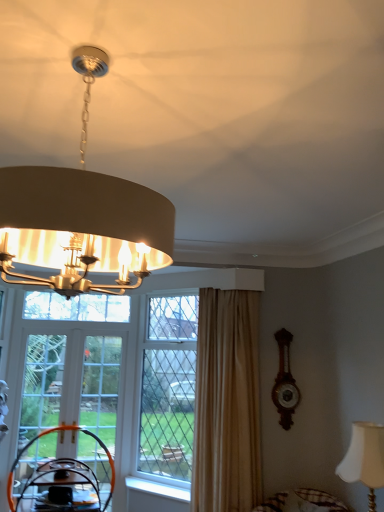
Question: Can you confirm if wooden clock at right is taller than clear glass door at lower left, the first screen door from the left?

Choices:
 (A) yes
 (B) no

Answer: (B)

Question: Considering the relative sizes of wooden clock at right and clear glass door at lower left, which is the 2th screen door from right to left, in the image provided, is wooden clock at right smaller than clear glass door at lower left, which is the 2th screen door from right to left,?

Choices:
 (A) yes
 (B) no

Answer: (A)

Question: Is wooden clock at right not near clear glass door at lower left, the first screen door from the left?

Choices:
 (A) no
 (B) yes

Answer: (B)

Question: From the image's perspective, is wooden clock at right over clear glass door at lower left, which is the 2th screen door from right to left?

Choices:
 (A) yes
 (B) no

Answer: (A)

Question: Does wooden clock at right appear on the left side of clear glass door at lower left, the first screen door from the left?

Choices:
 (A) yes
 (B) no

Answer: (B)

Question: Considering the relative sizes of wooden clock at right and clear glass door at lower left, the first screen door from the left, in the image provided, is wooden clock at right thinner than clear glass door at lower left, the first screen door from the left,?

Choices:
 (A) no
 (B) yes

Answer: (A)

Question: From a real-world perspective, is clear glass door at lower left, the first screen door from the left, positioned under matte beige lampshade at upper center, the 2th lamp when ordered from back to front, based on gravity?

Choices:
 (A) no
 (B) yes

Answer: (B)

Question: Are clear glass door at lower left, which is the 2th screen door from right to left, and matte beige lampshade at upper center, the 2th lamp from the bottom, located far from each other?

Choices:
 (A) yes
 (B) no

Answer: (A)

Question: Are clear glass door at lower left, the first screen door from the left, and matte beige lampshade at upper center, the 2th lamp when ordered from back to front, beside each other?

Choices:
 (A) yes
 (B) no

Answer: (B)

Question: Is clear glass door at lower left, which is the 2th screen door from right to left, oriented towards matte beige lampshade at upper center, the 2th lamp when ordered from back to front?

Choices:
 (A) no
 (B) yes

Answer: (B)

Question: Can you confirm if clear glass door at lower left, which is the 2th screen door from right to left, is thinner than matte beige lampshade at upper center, the first lamp viewed from the top?

Choices:
 (A) no
 (B) yes

Answer: (B)

Question: Could matte beige lampshade at upper center, the 2th lamp when ordered from right to left, be considered to be inside clear glass door at lower left, which is the 2th screen door from right to left?

Choices:
 (A) no
 (B) yes

Answer: (A)

Question: Is white fabric lampshade at lower right, which is the first lamp in right-to-left order, shorter than beige fabric curtain at right?

Choices:
 (A) no
 (B) yes

Answer: (B)